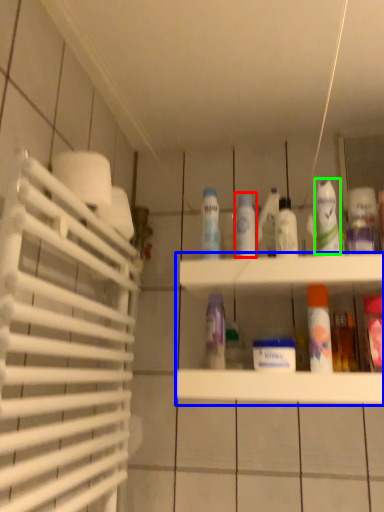
Question: Estimate the real-world distances between objects in this image. Which object is farther from mouthwash (highlighted by a red box), shelf (highlighted by a blue box) or cleaning product (highlighted by a green box)?

Choices:
 (A) shelf
 (B) cleaning product

Answer: (A)